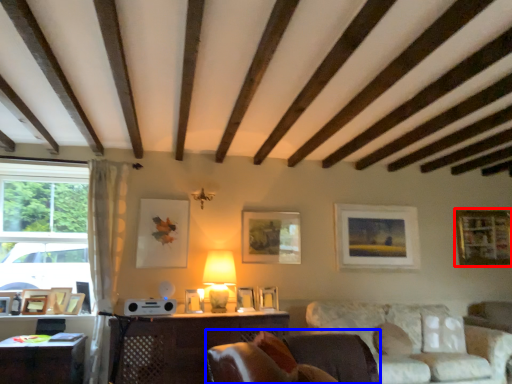
Question: Which object appears closest to the camera in this image, picture frame (highlighted by a red box) or rocking chair (highlighted by a blue box)?

Choices:
 (A) picture frame
 (B) rocking chair

Answer: (B)